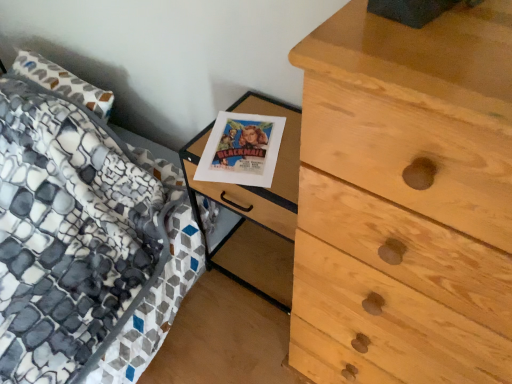
Question: Is wooden nightstand at center to the right of light brown wood chest of drawers at right from the viewer's perspective?

Choices:
 (A) no
 (B) yes

Answer: (A)

Question: Is light brown wood chest of drawers at right a part of wooden nightstand at center?

Choices:
 (A) yes
 (B) no

Answer: (B)

Question: Is wooden nightstand at center positioned far away from light brown wood chest of drawers at right?

Choices:
 (A) no
 (B) yes

Answer: (A)

Question: From a real-world perspective, is wooden nightstand at center physically above light brown wood chest of drawers at right?

Choices:
 (A) no
 (B) yes

Answer: (A)

Question: Is wooden nightstand at center wider than light brown wood chest of drawers at right?

Choices:
 (A) no
 (B) yes

Answer: (A)

Question: Considering the relative positions of wooden nightstand at center and light brown wood chest of drawers at right in the image provided, is wooden nightstand at center to the left of light brown wood chest of drawers at right from the viewer's perspective?

Choices:
 (A) yes
 (B) no

Answer: (A)

Question: From a real-world perspective, is patterned fabric bed at left physically below light brown wood chest of drawers at right?

Choices:
 (A) yes
 (B) no

Answer: (A)

Question: Could you tell me if patterned fabric bed at left is turned towards light brown wood chest of drawers at right?

Choices:
 (A) yes
 (B) no

Answer: (B)

Question: From the image's perspective, would you say patterned fabric bed at left is shown under light brown wood chest of drawers at right?

Choices:
 (A) no
 (B) yes

Answer: (A)

Question: Can you confirm if patterned fabric bed at left is positioned to the left of light brown wood chest of drawers at right?

Choices:
 (A) no
 (B) yes

Answer: (B)

Question: Can we say patterned fabric bed at left lies outside light brown wood chest of drawers at right?

Choices:
 (A) no
 (B) yes

Answer: (B)

Question: From the image's perspective, is patterned fabric bed at left on light brown wood chest of drawers at right?

Choices:
 (A) no
 (B) yes

Answer: (B)

Question: Is patterned fabric bed at left positioned before wooden nightstand at center?

Choices:
 (A) no
 (B) yes

Answer: (B)